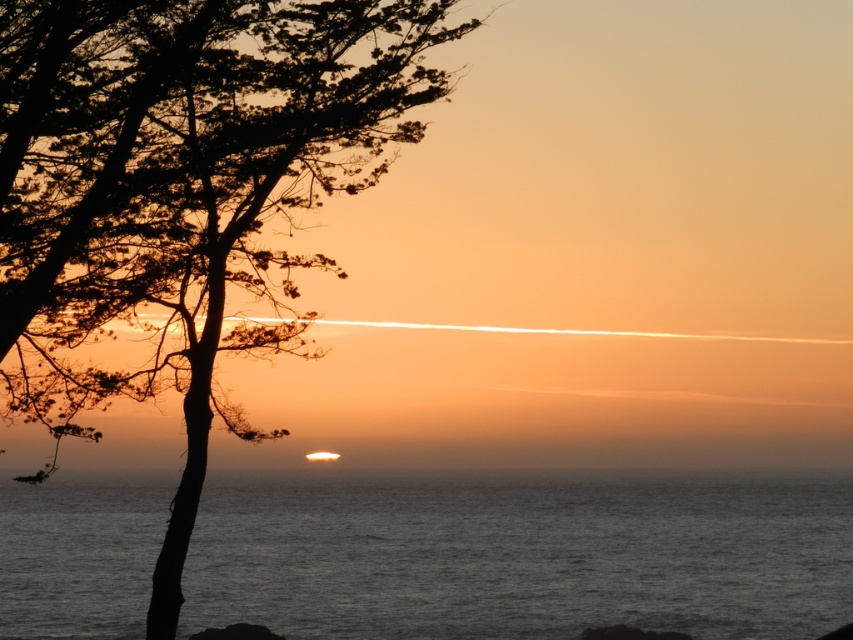
Is silhouette bark tree at left positioned in front of dark gray water at center?

Yes.

Does silhouette bark tree at left have a greater height compared to dark gray water at center?

Correct, silhouette bark tree at left is much taller as dark gray water at center.

Who is more distant from viewer, (x=3, y=378) or (x=415, y=490)?

The point (x=415, y=490) is behind.

The image size is (853, 640). Find the location of `silhouette bark tree at left`. silhouette bark tree at left is located at coordinates (181, 192).